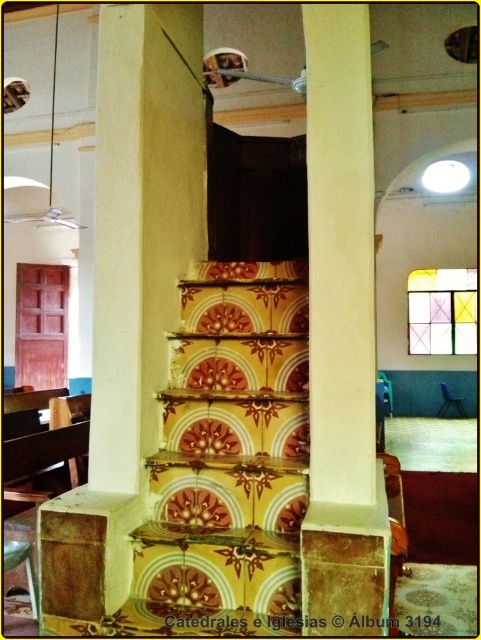
Who is positioned more to the left, yellow tile stairs at center or smooth cream-colored pillar at center?

yellow tile stairs at center

Does yellow tile stairs at center appear over smooth cream-colored pillar at center?

No.

Find the location of a particular element. This screenshot has height=640, width=481. yellow tile stairs at center is located at coordinates click(228, 460).